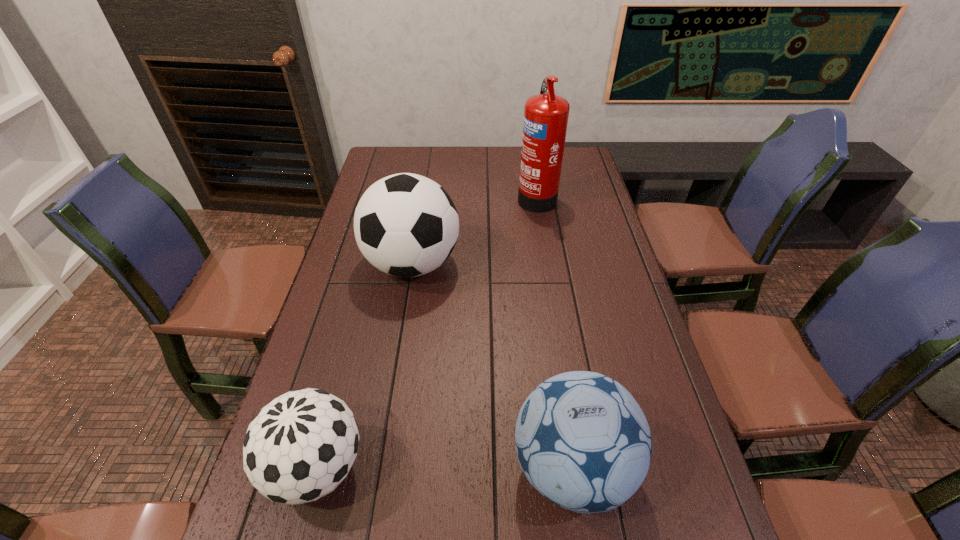
Image resolution: width=960 pixels, height=540 pixels. What are the coordinates of `the second closest object to the shortest soccer ball` in the screenshot? It's located at (406, 225).

Identify the location of the third closest object to the fire extinguisher. (299, 447).

You are a GUI agent. You are given a task and a screenshot of the screen. Output one action in this format:
    pyautogui.click(x=<x>, y=<y>)
    Task: Click on the soccer ball that is the nearest to the second tallest soccer ball
    The height and width of the screenshot is (540, 960).
    Given the screenshot: What is the action you would take?
    pyautogui.click(x=299, y=447)

Find the location of a particular element. The image size is (960, 540). soccer ball that is the closest to the tallest object is located at coordinates tap(406, 225).

Identify the location of blank space that satisfies the following two spatial constraints: 1. on the surface of the fire extinguisher; 2. on the front side of the third nearest object. (547, 264).